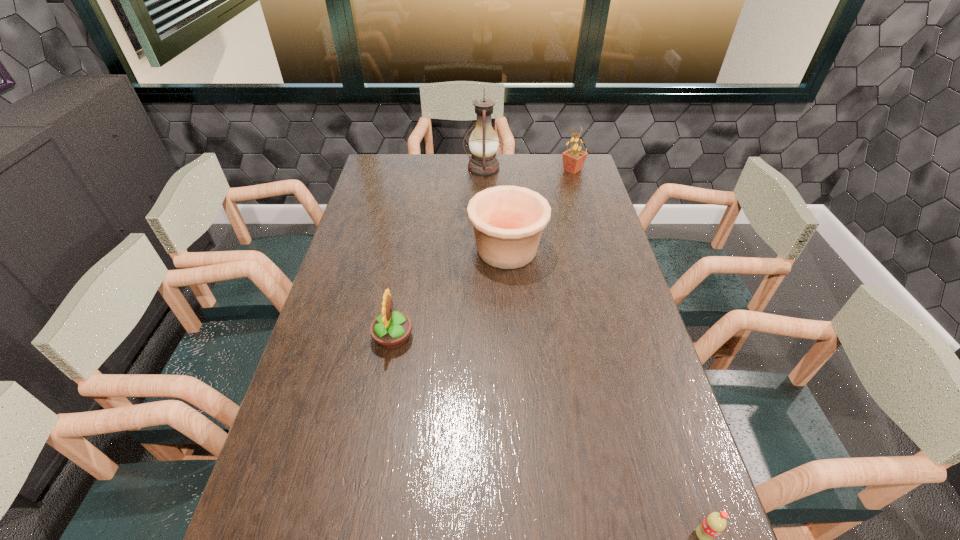
Identify the location of vacant area between the fourth farthest object and the tallest object. The image size is (960, 540). (438, 253).

Locate which object ranks second in proximity to the right sunflower. Please provide its 2D coordinates. Your answer should be formatted as a tuple, i.e. [(x, y)], where the tuple contains the x and y coordinates of a point satisfying the conditions above.

[(508, 221)]

Locate an element on the screen. This screenshot has height=540, width=960. object that is the second closest to the pottery is located at coordinates (483, 143).